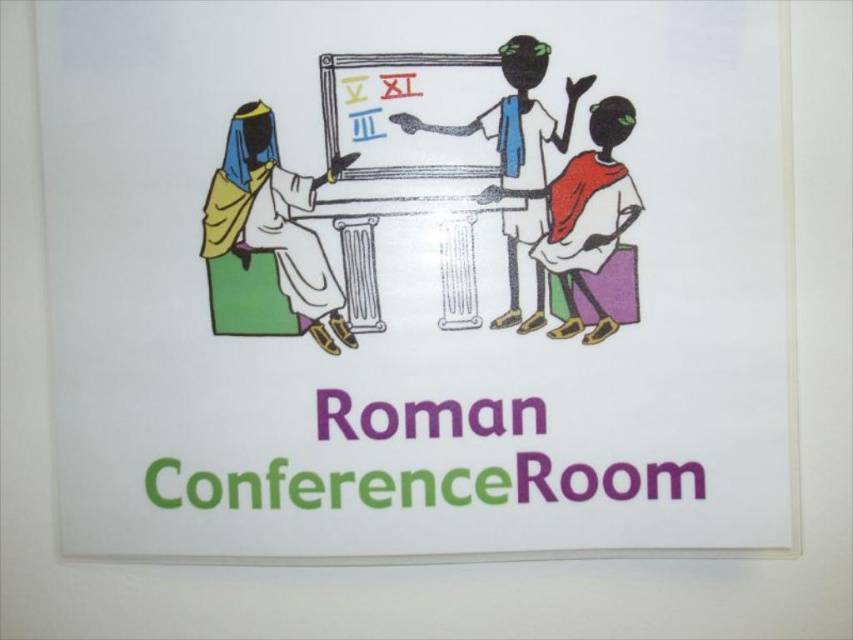
You are designing a poster for the Roman Conference Room and need to place both the purple paper roman conference room at center and the matte red dress at center. Since space is limited, which object should you scale down to fit both elements?

The matte red dress at center should be scaled down because the purple paper roman conference room at center is bigger than the matte red dress at center, so reducing the size of the smaller object would allow both to fit without overcrowding the poster.

You are designing a digital sign for the Roman Conference Room. The sign currently has two elements, the matte yellow fabric at left and the matte red dress at center. The design team wants to ensure there is enough space between these elements for text. If the minimum required spacing between elements for readability is 10 inches, does the current spacing meet the requirement?

The distance between the matte yellow fabric at left and matte red dress at center is 8.84 inches, which is less than the required 10 inches. Therefore, the current spacing does not meet the readability requirement.

Looking at the Roman Conference Room sign, which object has a greater width between the matte yellow fabric at left and the matte red dress at center?

The matte yellow fabric at left has a greater width than the matte red dress at center.